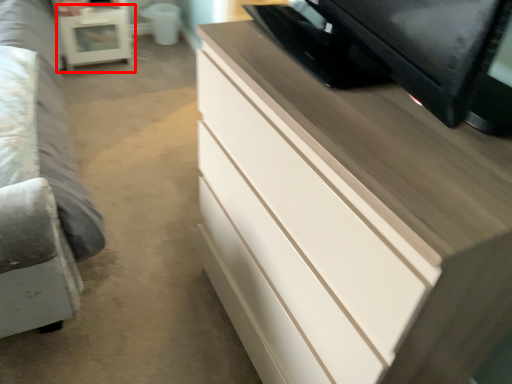
Question: From the image's perspective, what is the correct spatial relationship of table (annotated by the red box) in relation to chest of drawers?

Choices:
 (A) below
 (B) above

Answer: (B)